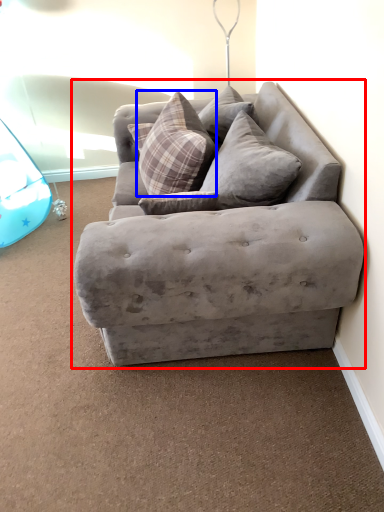
Question: Among these objects, which one is nearest to the camera, studio couch (highlighted by a red box) or pillow (highlighted by a blue box)?

Choices:
 (A) studio couch
 (B) pillow

Answer: (A)